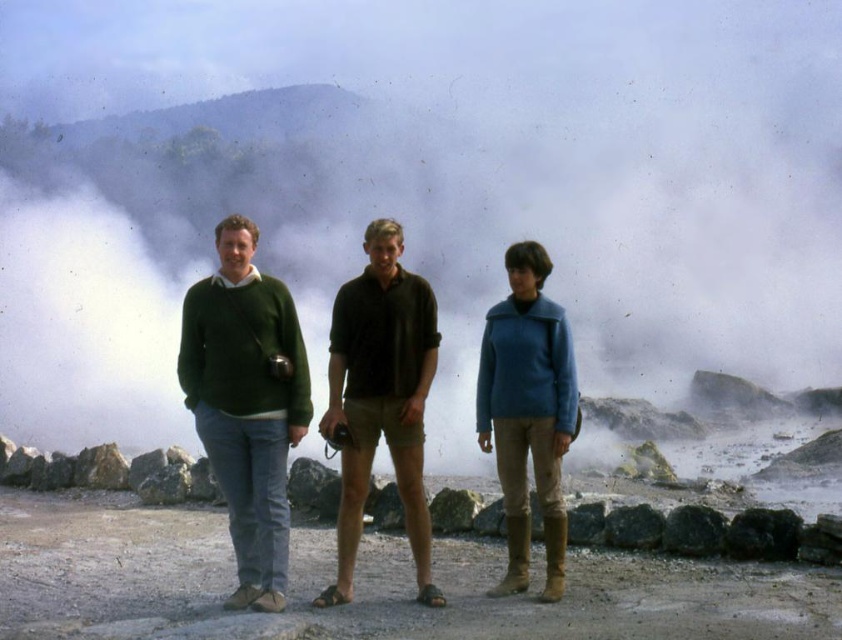
Question: Which point appears closest to the camera in this image?

Choices:
 (A) (409, 522)
 (B) (349, 513)

Answer: (B)

Question: Is dark green polo shirt at center closer to the viewer compared to blue woolen sweater at center?

Choices:
 (A) no
 (B) yes

Answer: (A)

Question: Is green wool sweater at center wider than blue woolen sweater at center?

Choices:
 (A) yes
 (B) no

Answer: (A)

Question: Estimate the real-world distances between objects in this image. Which object is farther from the blue woolen sweater at center?

Choices:
 (A) green sweater at left
 (B) dark green polo shirt at center
 (C) green wool sweater at center

Answer: (A)

Question: Does dark green polo shirt at center come behind blue woolen sweater at center?

Choices:
 (A) no
 (B) yes

Answer: (B)

Question: Which point appears closest to the camera in this image?

Choices:
 (A) [493, 308]
 (B) [395, 282]
 (C) [228, 378]
 (D) [137, 284]

Answer: (C)